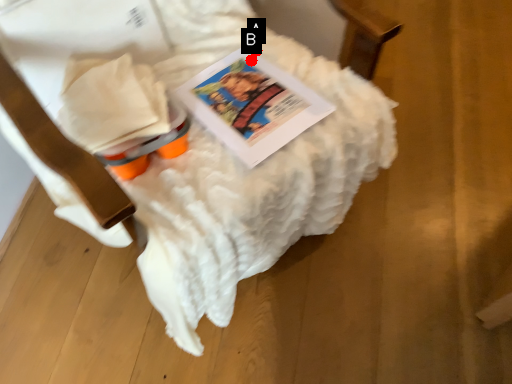
Question: Two points are circled on the image, labeled by A and B beside each circle. Which point appears farthest from the camera in this image?

Choices:
 (A) A is further
 (B) B is further

Answer: (A)